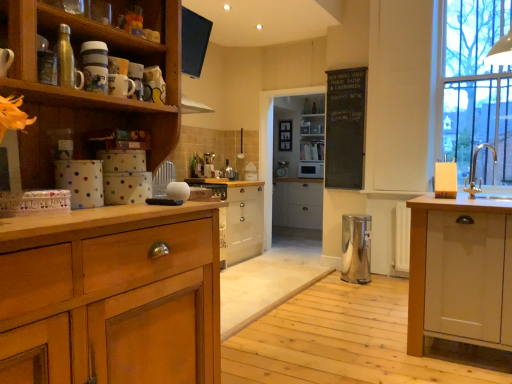
Question: Does point (257, 231) appear closer or farther from the camera than point (495, 150)?

Choices:
 (A) closer
 (B) farther

Answer: (B)

Question: Based on their positions, is wooden cabinet at center, the second cabinetry positioned from the right, located to the left or right of silver metallic sink at right?

Choices:
 (A) right
 (B) left

Answer: (B)

Question: Considering the real-world distances, which object is closest to the clear glass window at right?

Choices:
 (A) white glossy microwave at center, the 1th appliance when ordered from back to front
 (B) white glossy toaster at center, acting as the 3th appliance starting from the top
 (C) wooden cabinet at center, the second cabinetry positioned from the right
 (D) metallic silver water bottle at upper left, the 1th appliance positioned from the front
 (E) silver metallic sink at right

Answer: (E)

Question: Which object is the closest to the wooden shelf at center?

Choices:
 (A) white wood cabinet at center, the second cabinetry viewed from the left
 (B) polished stainless steel trash can at center, which is counted as the fourth appliance, starting from the top
 (C) metallic silver water bottle at upper left, which ranks as the fourth appliance in bottom-to-top order
 (D) wooden cabinet at center, the second cabinetry positioned from the right
 (E) white glossy microwave at center, the 1th appliance when ordered from back to front

Answer: (E)